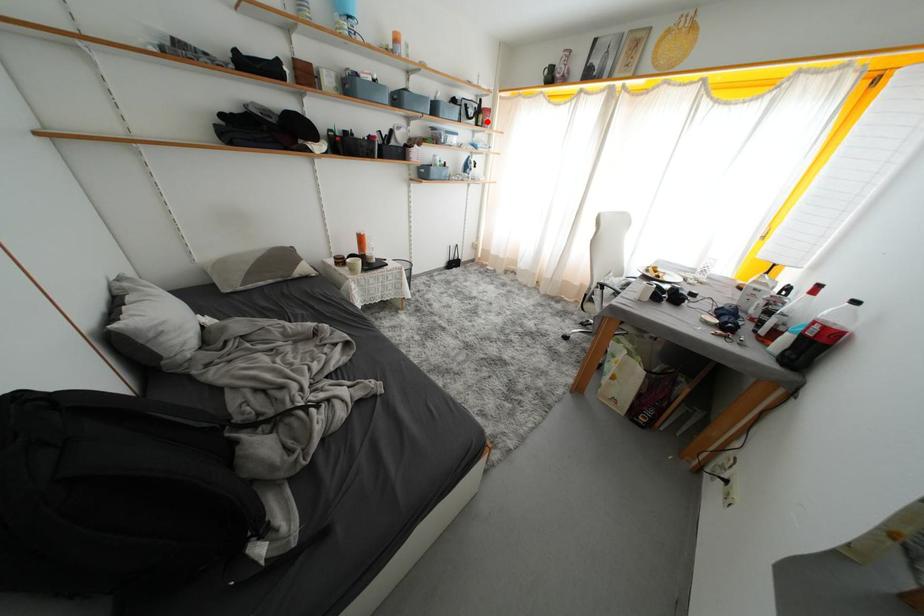
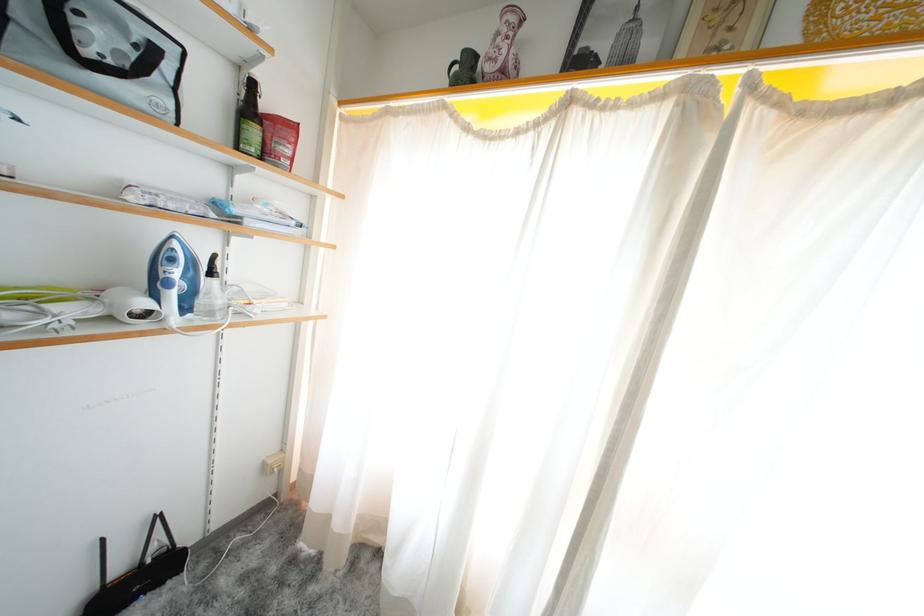
In the second image, find the point that corresponds to the highlighted location in the first image.

(261, 137)